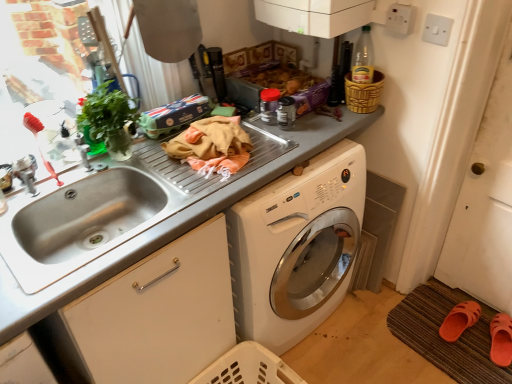
Describe the element at coordinates (89, 216) in the screenshot. The width and height of the screenshot is (512, 384). I see `stainless steel sink at left` at that location.

This screenshot has width=512, height=384. Describe the element at coordinates (169, 225) in the screenshot. I see `gray matte countertop at center` at that location.

Locate an element on the screen. The image size is (512, 384). bamboo textured basket at upper right is located at coordinates (362, 93).

What do you see at coordinates (485, 204) in the screenshot? I see `white matte screen door at right` at bounding box center [485, 204].

Where is `white matte screen door at right`? The width and height of the screenshot is (512, 384). white matte screen door at right is located at coordinates (485, 204).

The image size is (512, 384). Describe the element at coordinates (437, 29) in the screenshot. I see `white plastic switch at upper right, the 1th electric outlet when ordered from right to left` at that location.

Find the location of a particular element. white plastic electric outlet at upper right, acting as the 1th electric outlet starting from the left is located at coordinates (400, 18).

Is point (112, 131) positioned behind point (398, 15)?

No.

From a real-world perspective, between green leafy plant at left and white plastic electric outlet at upper right, marked as the second electric outlet in a right-to-left arrangement, who is vertically lower?

From a 3D spatial view, green leafy plant at left is below.

Can you confirm if green leafy plant at left is positioned to the left of white plastic electric outlet at upper right, marked as the second electric outlet in a right-to-left arrangement?

Yes, green leafy plant at left is to the left of white plastic electric outlet at upper right, marked as the second electric outlet in a right-to-left arrangement.

Is green leafy plant at left facing towards white plastic electric outlet at upper right, acting as the 1th electric outlet starting from the left?

No.

Are bamboo textured basket at upper right and brown woven mat at lower right beside each other?

They are not placed beside each other.

Considering the relative positions of bamboo textured basket at upper right and brown woven mat at lower right in the image provided, is bamboo textured basket at upper right in front of brown woven mat at lower right?

Yes.

Which of these two, bamboo textured basket at upper right or brown woven mat at lower right, stands taller?

Standing taller between the two is bamboo textured basket at upper right.

Looking at this image, does bamboo textured basket at upper right contain brown woven mat at lower right?

No, brown woven mat at lower right is located outside of bamboo textured basket at upper right.

Considering the sizes of gray matte countertop at center and white plastic switch at upper right, which is the 2th electric outlet from left to right, in the image, is gray matte countertop at center wider or thinner than white plastic switch at upper right, which is the 2th electric outlet from left to right,?

Considering their sizes, gray matte countertop at center looks broader than white plastic switch at upper right, which is the 2th electric outlet from left to right.

Is gray matte countertop at center to the left or to the right of white plastic switch at upper right, which is the 2th electric outlet from left to right, in the image?

From the image, it's evident that gray matte countertop at center is to the left of white plastic switch at upper right, which is the 2th electric outlet from left to right.

Is gray matte countertop at center positioned with its back to white plastic switch at upper right, the 1th electric outlet when ordered from right to left?

No.

Find the location of `electric outlet that is the 1st object located behind the gray matte countertop at center`. electric outlet that is the 1st object located behind the gray matte countertop at center is located at coordinates (437, 29).

Looking at this image, considering the relative sizes of white plastic electric outlet at upper right, acting as the 1th electric outlet starting from the left, and stainless steel sink at left in the image provided, is white plastic electric outlet at upper right, acting as the 1th electric outlet starting from the left, smaller than stainless steel sink at left?

Indeed, white plastic electric outlet at upper right, acting as the 1th electric outlet starting from the left, has a smaller size compared to stainless steel sink at left.

In order to click on sink that is under the white plastic electric outlet at upper right, marked as the second electric outlet in a right-to-left arrangement (from a real-world perspective) in this screenshot , I will do `click(89, 216)`.

Consider the image. Measure the distance from white plastic electric outlet at upper right, acting as the 1th electric outlet starting from the left, to stainless steel sink at left.

white plastic electric outlet at upper right, acting as the 1th electric outlet starting from the left, and stainless steel sink at left are 1.17 meters apart from each other.

From the picture: Is white plastic electric outlet at upper right, acting as the 1th electric outlet starting from the left, far away from stainless steel sink at left?

That's right, there is a large distance between white plastic electric outlet at upper right, acting as the 1th electric outlet starting from the left, and stainless steel sink at left.

Considering the relative positions of orange rubber slipper at lower right and white plastic switch at upper right, which is the 2th electric outlet from left to right, in the image provided, is orange rubber slipper at lower right to the right of white plastic switch at upper right, which is the 2th electric outlet from left to right, from the viewer's perspective?

Yes, orange rubber slipper at lower right is to the right of white plastic switch at upper right, which is the 2th electric outlet from left to right.

From the image's perspective, does orange rubber slipper at lower right appear lower than white plastic switch at upper right, the 1th electric outlet when ordered from right to left?

Yes, from the image's perspective, orange rubber slipper at lower right is below white plastic switch at upper right, the 1th electric outlet when ordered from right to left.

Between orange rubber slipper at lower right and white plastic switch at upper right, which is the 2th electric outlet from left to right, which one has less height?

Standing shorter between the two is orange rubber slipper at lower right.

Could you tell me if orange rubber slipper at lower right is facing white plastic switch at upper right, which is the 2th electric outlet from left to right?

No, orange rubber slipper at lower right is not aimed at white plastic switch at upper right, which is the 2th electric outlet from left to right.

Identify the location of electric outlet that is the 2nd object to the right of the gray matte countertop at center, starting at the anchor. (437, 29).

Which of these two, white plastic switch at upper right, which is the 2th electric outlet from left to right, or gray matte countertop at center, is wider?

gray matte countertop at center.

From the image's perspective, is white plastic switch at upper right, the 1th electric outlet when ordered from right to left, above gray matte countertop at center?

Yes, from the image's perspective, white plastic switch at upper right, the 1th electric outlet when ordered from right to left, is on top of gray matte countertop at center.

From the image's perspective, is bamboo textured basket at upper right over white plastic electric outlet at upper right, marked as the second electric outlet in a right-to-left arrangement?

No, from the image's perspective, bamboo textured basket at upper right is not over white plastic electric outlet at upper right, marked as the second electric outlet in a right-to-left arrangement.

Relative to white plastic electric outlet at upper right, acting as the 1th electric outlet starting from the left, is bamboo textured basket at upper right in front or behind?

bamboo textured basket at upper right is behind white plastic electric outlet at upper right, acting as the 1th electric outlet starting from the left.

Is bamboo textured basket at upper right not inside white plastic electric outlet at upper right, acting as the 1th electric outlet starting from the left?

Yes.

Locate an element on the screen. This screenshot has height=384, width=512. plant that appears on the left of white plastic electric outlet at upper right, acting as the 1th electric outlet starting from the left is located at coordinates (108, 119).

The height and width of the screenshot is (384, 512). I want to click on doormat directly beneath the bamboo textured basket at upper right (from a real-world perspective), so click(442, 339).

Estimate the real-world distances between objects in this image. Which object is further from stainless steel sink at left, orange rubber slipper at lower right or gray matte countertop at center?

orange rubber slipper at lower right.

Which object lies further to the anchor point brown woven mat at lower right, stainless steel sink at left or white plastic switch at upper right, the 1th electric outlet when ordered from right to left?

Among the two, stainless steel sink at left is located further to brown woven mat at lower right.

Considering their positions, is bamboo textured basket at upper right positioned closer to white matte screen door at right than white plastic switch at upper right, the 1th electric outlet when ordered from right to left?

Based on the image, bamboo textured basket at upper right appears to be nearer to white matte screen door at right.

From the image, which object appears to be nearer to white plastic electric outlet at upper right, acting as the 1th electric outlet starting from the left, brown woven mat at lower right or bamboo textured basket at upper right?

Based on the image, bamboo textured basket at upper right appears to be nearer to white plastic electric outlet at upper right, acting as the 1th electric outlet starting from the left.

When comparing their distances from green leafy plant at left, does brown woven mat at lower right or bamboo textured basket at upper right seem further?

brown woven mat at lower right is positioned further to the anchor green leafy plant at left.

Which object lies nearer to the anchor point stainless steel sink at left, gray matte countertop at center or brown woven mat at lower right?

Among the two, gray matte countertop at center is located nearer to stainless steel sink at left.

Considering their positions, is white plastic electric outlet at upper right, marked as the second electric outlet in a right-to-left arrangement, positioned closer to gray matte countertop at center than green leafy plant at left?

Based on the image, green leafy plant at left appears to be nearer to gray matte countertop at center.

Looking at the image, which one is located closer to white plastic switch at upper right, the 1th electric outlet when ordered from right to left, orange rubber slipper at lower right or green leafy plant at left?

The object closer to white plastic switch at upper right, the 1th electric outlet when ordered from right to left, is green leafy plant at left.

Identify the location of basket between green leafy plant at left and white plastic electric outlet at upper right, acting as the 1th electric outlet starting from the left, in the horizontal direction. The height and width of the screenshot is (384, 512). (362, 93).

At what (x,y) coordinates should I click in order to perform the action: click on doormat located between green leafy plant at left and orange rubber slipper at lower right in the left-right direction. Please return your answer as a coordinate pair (x, y). Looking at the image, I should click on (442, 339).

Find the location of a particular element. countertop between white plastic electric outlet at upper right, acting as the 1th electric outlet starting from the left, and brown woven mat at lower right, in the vertical direction is located at coordinates (169, 225).

The image size is (512, 384). Identify the location of doormat between stainless steel sink at left and white matte screen door at right. (442, 339).